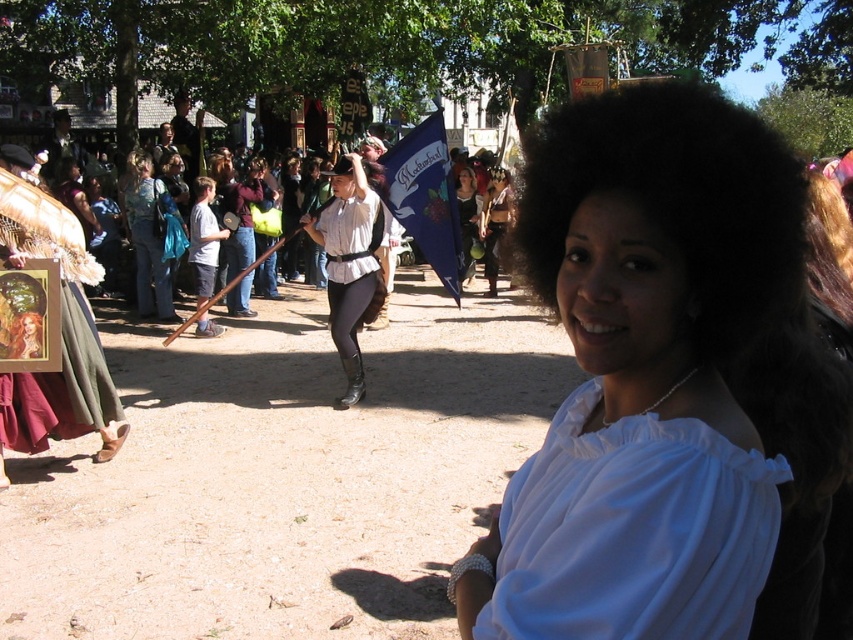
You are a photographer at the event and want to capture a photo that includes both the blue fabric flag at center and the matte brown hair at center in the same frame. Given that your camera has a 50mm lens, which has a field of view that can capture objects up to 15 feet apart, will you be able to include both objects in the frame?

The blue fabric flag at center and the matte brown hair at center are 16.86 feet apart from each other. Since the camera lens can only capture up to 15 feet, you won feet apart, so you won

You are a photographer trying to capture the blue fabric flag at center and the matte black dress at center in the same frame. Which object should you focus on first to ensure both are in the frame?

The blue fabric flag at center is taller than the matte black dress at center, so you should focus on the blue fabric flag at center first to ensure both are in the frame.